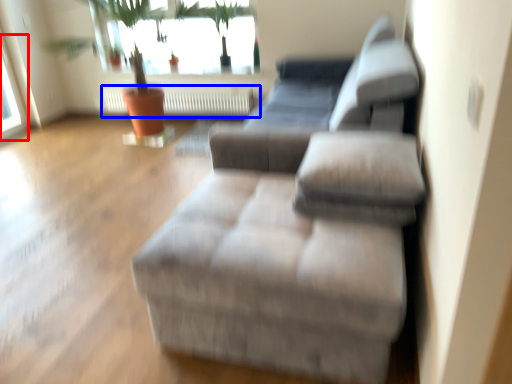
Question: Among these objects, which one is nearest to the camera, window (highlighted by a red box) or radiator (highlighted by a blue box)?

Choices:
 (A) window
 (B) radiator

Answer: (A)